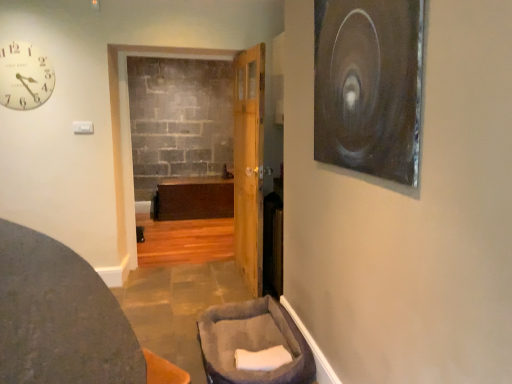
Describe the element at coordinates (24, 76) in the screenshot. I see `matte white clock at upper left` at that location.

You are a GUI agent. You are given a task and a screenshot of the screen. Output one action in this format:
    pyautogui.click(x=<x>, y=<y>)
    Task: Click on the matte white clock at upper left
    This screenshot has height=384, width=512.
    Given the screenshot: What is the action you would take?
    pyautogui.click(x=24, y=76)

Looking at this image, is wooden door at center turned away from matte white clock at upper left?

That's not correct — wooden door at center is not looking away from matte white clock at upper left.

You are a GUI agent. You are given a task and a screenshot of the screen. Output one action in this format:
    pyautogui.click(x=<x>, y=<y>)
    Task: Click on the clock above the wooden door at center (from the image's perspective)
    
    Given the screenshot: What is the action you would take?
    pyautogui.click(x=24, y=76)

Looking at this image, from the image's perspective, between wooden door at center and matte white clock at upper left, which one is located above?

matte white clock at upper left is shown above in the image.

Can you tell me how much wooden door at center and matte white clock at upper left differ in facing direction?

The angular difference between wooden door at center and matte white clock at upper left is 90.9 degrees.

Consider the image. Is matte white clock at upper left facing towards wooden door at center?

No, matte white clock at upper left is not oriented towards wooden door at center.

Is matte white clock at upper left behind wooden door at center?

Yes, it is.

From the image's perspective, is matte white clock at upper left below wooden door at center?

No.

Measure the distance between matte white clock at upper left and wooden door at center.

5.55 feet.

Based on the photo, can you confirm if wooden door at center is smaller than gray plush pet bed at lower center, arranged as the first furniture when viewed from the right?

Actually, wooden door at center might be larger than gray plush pet bed at lower center, arranged as the first furniture when viewed from the right.

From a real-world perspective, is wooden door at center physically above gray plush pet bed at lower center, positioned as the 2th furniture in left-to-right order?

Correct, in the physical world, wooden door at center is higher than gray plush pet bed at lower center, positioned as the 2th furniture in left-to-right order.

Is gray plush pet bed at lower center, arranged as the first furniture when viewed from the right, at the back of wooden door at center?

wooden door at center does not have its back to gray plush pet bed at lower center, arranged as the first furniture when viewed from the right.

Where is `door above the gray plush pet bed at lower center, arranged as the first furniture when viewed from the right (from a real-world perspective)`? The image size is (512, 384). door above the gray plush pet bed at lower center, arranged as the first furniture when viewed from the right (from a real-world perspective) is located at coordinates (249, 163).

In terms of width, does metallic silver circular object at upper right look wider or thinner when compared to gray plush pet bed at lower center, arranged as the first furniture when viewed from the right?

In the image, metallic silver circular object at upper right appears to be more narrow than gray plush pet bed at lower center, arranged as the first furniture when viewed from the right.

Consider the image. Does metallic silver circular object at upper right turn towards gray plush pet bed at lower center, positioned as the 2th furniture in left-to-right order?

No, metallic silver circular object at upper right is not facing towards gray plush pet bed at lower center, positioned as the 2th furniture in left-to-right order.

From a real-world perspective, is metallic silver circular object at upper right under gray plush pet bed at lower center, arranged as the first furniture when viewed from the right?

Incorrect, from a real-world perspective, metallic silver circular object at upper right is higher than gray plush pet bed at lower center, arranged as the first furniture when viewed from the right.

Image resolution: width=512 pixels, height=384 pixels. In order to click on picture frame above the gray plush pet bed at lower center, arranged as the first furniture when viewed from the right (from a real-world perspective) in this screenshot , I will do `click(369, 86)`.

Is dark gray fabric ottoman at lower left, the first furniture positioned from the left, oriented towards gray plush pet bed at lower center, arranged as the first furniture when viewed from the right?

No.

Would you say dark gray fabric ottoman at lower left, which is the second furniture in right-to-left order, is inside or outside gray plush pet bed at lower center, positioned as the 2th furniture in left-to-right order?

dark gray fabric ottoman at lower left, which is the second furniture in right-to-left order, cannot be found inside gray plush pet bed at lower center, positioned as the 2th furniture in left-to-right order.

From the image's perspective, is dark gray fabric ottoman at lower left, the first furniture positioned from the left, above or below gray plush pet bed at lower center, positioned as the 2th furniture in left-to-right order?

dark gray fabric ottoman at lower left, the first furniture positioned from the left, is situated higher than gray plush pet bed at lower center, positioned as the 2th furniture in left-to-right order, in the image.

Considering the sizes of objects dark gray fabric ottoman at lower left, which is the second furniture in right-to-left order, and gray plush pet bed at lower center, positioned as the 2th furniture in left-to-right order, in the image provided, who is bigger, dark gray fabric ottoman at lower left, which is the second furniture in right-to-left order, or gray plush pet bed at lower center, positioned as the 2th furniture in left-to-right order,?

dark gray fabric ottoman at lower left, which is the second furniture in right-to-left order.

Is dark gray fabric ottoman at lower left, the first furniture positioned from the left, bigger than matte white clock at upper left?

Correct, dark gray fabric ottoman at lower left, the first furniture positioned from the left, is larger in size than matte white clock at upper left.

Where is `clock that appears on the left of dark gray fabric ottoman at lower left, the first furniture positioned from the left`? The image size is (512, 384). clock that appears on the left of dark gray fabric ottoman at lower left, the first furniture positioned from the left is located at coordinates (24, 76).

Does point (123, 356) appear closer or farther from the camera than point (28, 106)?

Point (123, 356) is positioned closer to the camera compared to point (28, 106).

Is dark gray fabric ottoman at lower left, the first furniture positioned from the left, outside of matte white clock at upper left?

Yes, dark gray fabric ottoman at lower left, the first furniture positioned from the left, is not within matte white clock at upper left.

In the image, there is a gray plush pet bed at lower center, arranged as the first furniture when viewed from the right. At what (x,y) coordinates should I click in order to perform the action: click on picture frame above it (from the image's perspective). Please return your answer as a coordinate pair (x, y). This screenshot has height=384, width=512. Looking at the image, I should click on (369, 86).

Who is bigger, gray plush pet bed at lower center, arranged as the first furniture when viewed from the right, or metallic silver circular object at upper right?

gray plush pet bed at lower center, arranged as the first furniture when viewed from the right, is bigger.

From a real-world perspective, does gray plush pet bed at lower center, positioned as the 2th furniture in left-to-right order, sit lower than metallic silver circular object at upper right?

Yes, from a real-world perspective, gray plush pet bed at lower center, positioned as the 2th furniture in left-to-right order, is beneath metallic silver circular object at upper right.

Looking at this image, is gray plush pet bed at lower center, arranged as the first furniture when viewed from the right, not near metallic silver circular object at upper right?

gray plush pet bed at lower center, arranged as the first furniture when viewed from the right, is positioned a significant distance from metallic silver circular object at upper right.

The image size is (512, 384). In the image, there is a matte white clock at upper left. In order to click on door below it (from a real-world perspective) in this screenshot , I will do click(x=249, y=163).

Find the location of a particular element. Image resolution: width=512 pixels, height=384 pixels. door that is below the matte white clock at upper left (from the image's perspective) is located at coordinates (249, 163).

Estimate the real-world distances between objects in this image. Which object is further from dark gray fabric ottoman at lower left, which is the second furniture in right-to-left order, metallic silver circular object at upper right or wooden door at center?

wooden door at center is positioned further to the anchor dark gray fabric ottoman at lower left, which is the second furniture in right-to-left order.

Which object lies nearer to the anchor point metallic silver circular object at upper right, gray plush pet bed at lower center, positioned as the 2th furniture in left-to-right order, or dark gray fabric ottoman at lower left, the first furniture positioned from the left?

Among the two, dark gray fabric ottoman at lower left, the first furniture positioned from the left, is located nearer to metallic silver circular object at upper right.

Considering their positions, is wooden door at center positioned further to gray plush pet bed at lower center, positioned as the 2th furniture in left-to-right order, than matte white clock at upper left?

Based on the image, matte white clock at upper left appears to be further to gray plush pet bed at lower center, positioned as the 2th furniture in left-to-right order.

From the image, which object appears to be farther from gray plush pet bed at lower center, positioned as the 2th furniture in left-to-right order, matte white clock at upper left or wooden door at center?

matte white clock at upper left lies further to gray plush pet bed at lower center, positioned as the 2th furniture in left-to-right order, than the other object.

Looking at the image, which one is located closer to gray plush pet bed at lower center, arranged as the first furniture when viewed from the right, wooden door at center or metallic silver circular object at upper right?

Among the two, wooden door at center is located nearer to gray plush pet bed at lower center, arranged as the first furniture when viewed from the right.

Looking at the image, which one is located further to metallic silver circular object at upper right, matte white clock at upper left or dark gray fabric ottoman at lower left, which is the second furniture in right-to-left order?

matte white clock at upper left.

Looking at the image, which one is located further to dark gray fabric ottoman at lower left, the first furniture positioned from the left, wooden door at center or matte white clock at upper left?

Among the two, wooden door at center is located further to dark gray fabric ottoman at lower left, the first furniture positioned from the left.

Considering their positions, is gray plush pet bed at lower center, arranged as the first furniture when viewed from the right, positioned further to matte white clock at upper left than dark gray fabric ottoman at lower left, the first furniture positioned from the left?

gray plush pet bed at lower center, arranged as the first furniture when viewed from the right, lies further to matte white clock at upper left than the other object.

The image size is (512, 384). What are the coordinates of `door between dark gray fabric ottoman at lower left, which is the second furniture in right-to-left order, and matte white clock at upper left in the front-back direction` in the screenshot? It's located at (249, 163).

You are a GUI agent. You are given a task and a screenshot of the screen. Output one action in this format:
    pyautogui.click(x=<x>, y=<y>)
    Task: Click on the door located between matte white clock at upper left and gray plush pet bed at lower center, arranged as the first furniture when viewed from the right, in the left-right direction
    Image resolution: width=512 pixels, height=384 pixels.
    Given the screenshot: What is the action you would take?
    pyautogui.click(x=249, y=163)

You are a GUI agent. You are given a task and a screenshot of the screen. Output one action in this format:
    pyautogui.click(x=<x>, y=<y>)
    Task: Click on the picture frame between dark gray fabric ottoman at lower left, which is the second furniture in right-to-left order, and matte white clock at upper left, along the z-axis
    
    Given the screenshot: What is the action you would take?
    point(369,86)

The height and width of the screenshot is (384, 512). I want to click on picture frame located between dark gray fabric ottoman at lower left, the first furniture positioned from the left, and wooden door at center in the depth direction, so click(x=369, y=86).